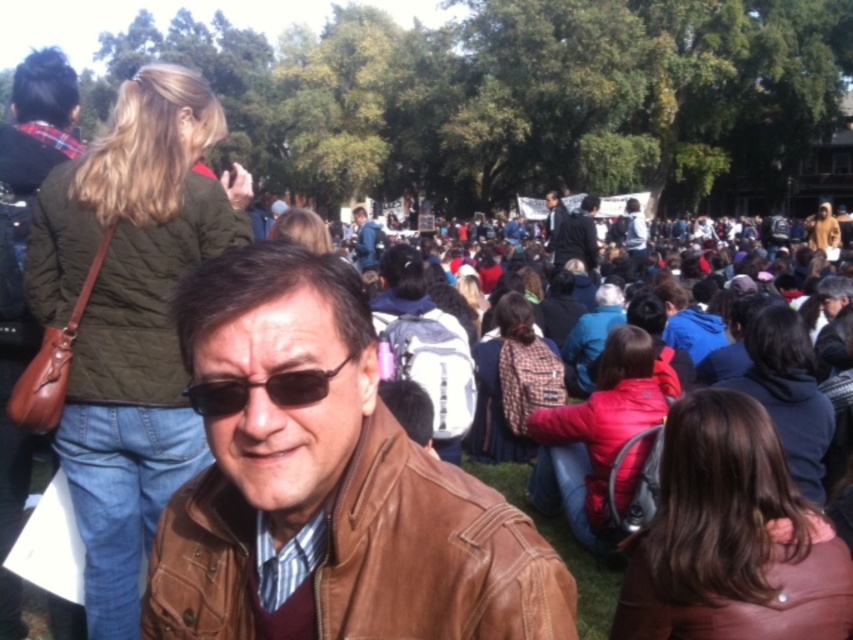
Question: Estimate the real-world distances between objects in this image. Which object is farther from the blue denim jacket at center?

Choices:
 (A) dark gray jacket at center
 (B) dark blue leather jacket at center
 (C) brown leather jacket at center
 (D) black leather goggles at center

Answer: (D)

Question: Can you confirm if dark gray jacket at center is smaller than blue denim jacket at center?

Choices:
 (A) no
 (B) yes

Answer: (B)

Question: Can you confirm if black leather goggles at center is thinner than dark gray jacket at center?

Choices:
 (A) yes
 (B) no

Answer: (A)

Question: Among these objects, which one is farthest from the camera?

Choices:
 (A) dark gray jacket at center
 (B) dark blue leather jacket at center
 (C) brown leather jacket at center

Answer: (B)

Question: Which object appears closest to the camera in this image?

Choices:
 (A) dark blue leather jacket at center
 (B) dark gray jacket at center

Answer: (B)

Question: Is black leather goggles at center further to camera compared to dark gray jacket at center?

Choices:
 (A) no
 (B) yes

Answer: (A)